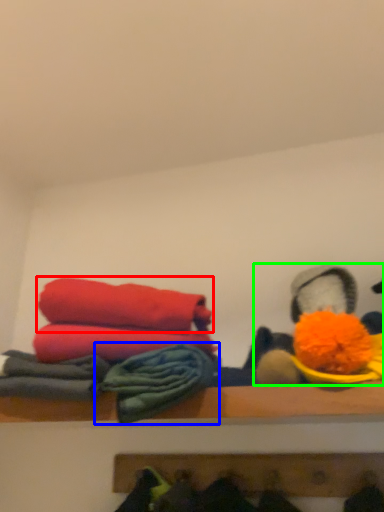
Question: Based on their relative distances, which object is nearer to towel (highlighted by a red box)? Choose from material (highlighted by a blue box) and toy (highlighted by a green box).

Choices:
 (A) material
 (B) toy

Answer: (A)